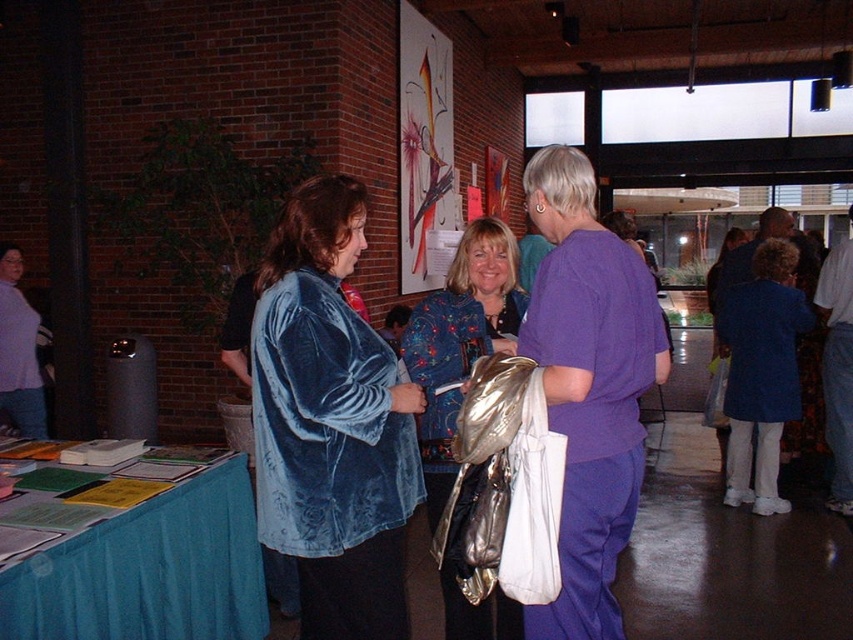
Is point (653, 330) closer to camera compared to point (68, 593)?

No, it is behind (68, 593).

Between point (642, 356) and point (25, 564), which one is positioned in front?

Positioned in front is point (25, 564).

Locate an element on the screen. purple velvety scrubs at center is located at coordinates (589, 385).

Consider the image. Is purple velvety scrubs at center positioned behind floral-patterned fabric at center?

No.

Does purple velvety scrubs at center appear on the right side of floral-patterned fabric at center?

Indeed, purple velvety scrubs at center is positioned on the right side of floral-patterned fabric at center.

At what (x,y) coordinates should I click in order to perform the action: click on purple velvety scrubs at center. Please return your answer as a coordinate pair (x, y). The width and height of the screenshot is (853, 640). Looking at the image, I should click on point(589,385).

Who is shorter, velvet blue jacket at center or teal fabric table at lower left?

teal fabric table at lower left

Is velvet blue jacket at center to the right of teal fabric table at lower left from the viewer's perspective?

Correct, you'll find velvet blue jacket at center to the right of teal fabric table at lower left.

Where is `velvet blue jacket at center`? The width and height of the screenshot is (853, 640). velvet blue jacket at center is located at coordinates (331, 422).

The image size is (853, 640). What are the coordinates of `velvet blue jacket at center` in the screenshot? It's located at (331, 422).